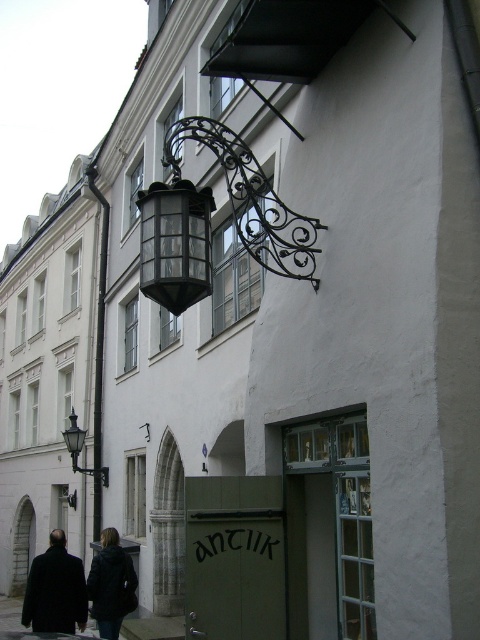
Does dark wool coat at lower left appear over dark gray jacket at lower left?

No, dark wool coat at lower left is not above dark gray jacket at lower left.

Does dark wool coat at lower left have a lesser height compared to dark gray jacket at lower left?

Incorrect, dark wool coat at lower left's height does not fall short of dark gray jacket at lower left's.

Identify the location of dark wool coat at lower left. (56, 589).

Where is `dark wool coat at lower left`? The width and height of the screenshot is (480, 640). dark wool coat at lower left is located at coordinates (56, 589).

Based on the photo, who is positioned more to the left, dark gray jacket at lower left or gray concrete pavement at lower center?

From the viewer's perspective, gray concrete pavement at lower center appears more on the left side.

Is point (96, 579) farther from viewer compared to point (9, 616)?

No.

Between point (106, 604) and point (135, 636), which one is positioned behind?

Point (135, 636)

You are a GUI agent. You are given a task and a screenshot of the screen. Output one action in this format:
    pyautogui.click(x=<x>, y=<y>)
    Task: Click on the dark gray jacket at lower left
    
    Given the screenshot: What is the action you would take?
    tap(110, 584)

Consider the image. Does gray concrete pavement at lower center appear under matte black lantern at left?

Indeed, gray concrete pavement at lower center is positioned under matte black lantern at left.

Locate an element on the screen. This screenshot has height=640, width=480. gray concrete pavement at lower center is located at coordinates (153, 627).

Is point (148, 632) positioned after point (76, 417)?

No, (148, 632) is closer to viewer.

I want to click on gray concrete pavement at lower center, so click(153, 627).